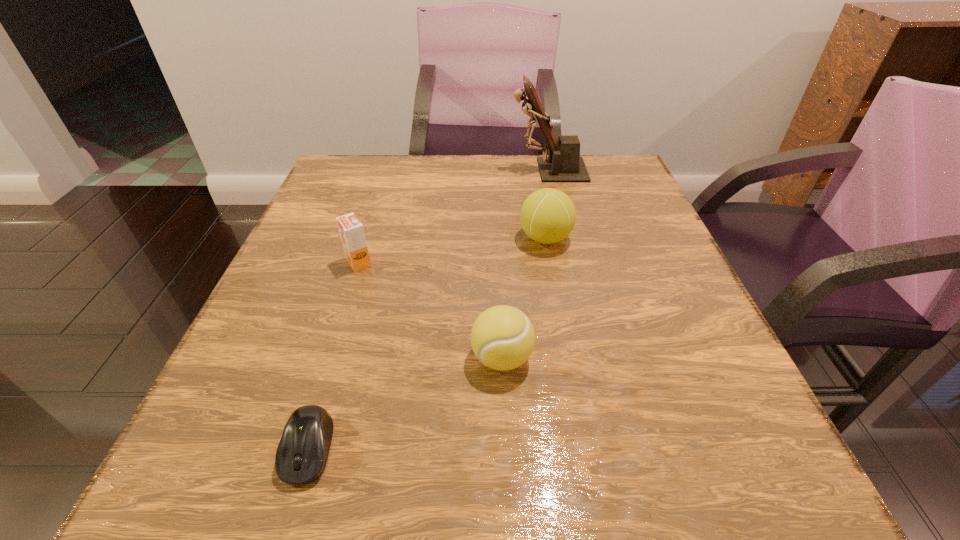
Find the location of a particular element. The width and height of the screenshot is (960, 540). free spot between the farther tennis ball and the fourth farthest object is located at coordinates (523, 298).

At what (x,y) coordinates should I click in order to perform the action: click on unoccupied area between the orange juice and the farthest object. Please return your answer as a coordinate pair (x, y). Looking at the image, I should click on (453, 217).

I want to click on free space between the nearer tennis ball and the tallest object, so click(525, 264).

Where is `free spot between the tallest object and the orange juice`? free spot between the tallest object and the orange juice is located at coordinates (453, 217).

The width and height of the screenshot is (960, 540). Find the location of `blank region between the orange juice and the figurine`. blank region between the orange juice and the figurine is located at coordinates (x=453, y=217).

Locate an element on the screen. This screenshot has width=960, height=540. empty location between the tallest object and the second nearest object is located at coordinates (525, 264).

In order to click on object that ranks as the third closest to the figurine in this screenshot , I will do `click(502, 337)`.

Identify the location of object that ranks as the fourth closest to the mouse. (563, 164).

At what (x,y) coordinates should I click in order to perform the action: click on free space that satisfies the following two spatial constraints: 1. on the front side of the fourth farthest object; 2. on the left side of the orange juice. Please return your answer as a coordinate pair (x, y). Image resolution: width=960 pixels, height=540 pixels. Looking at the image, I should click on (328, 358).

Image resolution: width=960 pixels, height=540 pixels. I want to click on vacant space that satisfies the following two spatial constraints: 1. on the back side of the nearest object; 2. on the left side of the nearer tennis ball, so click(336, 358).